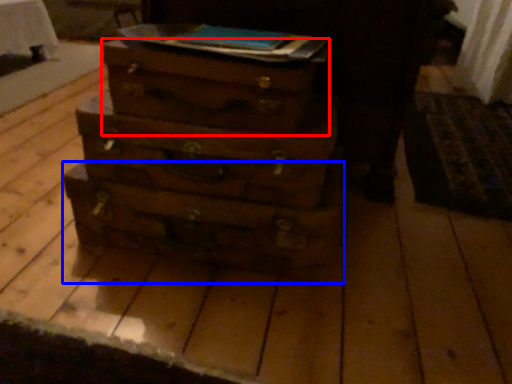
Question: Which of the following is the farthest to the observer, drawer (highlighted by a red box) or drawer (highlighted by a blue box)?

Choices:
 (A) drawer
 (B) drawer

Answer: (B)